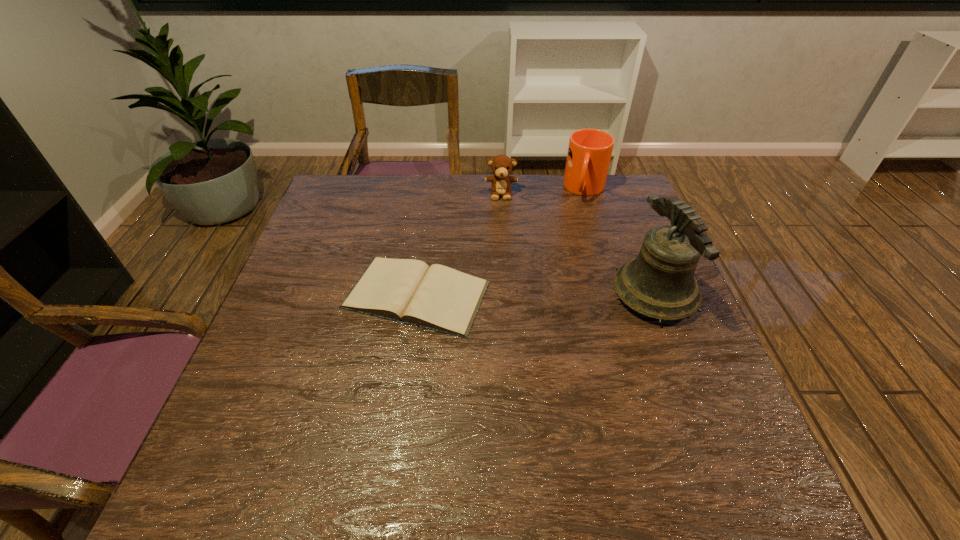
Locate an element on the screen. The height and width of the screenshot is (540, 960). empty space between the Bible and the second tallest object is located at coordinates (501, 242).

Locate an element on the screen. The height and width of the screenshot is (540, 960). free space that is in between the teddy bear and the mug is located at coordinates (543, 192).

Identify the location of blank region between the bell and the third tallest object. (578, 244).

Locate an element on the screen. The height and width of the screenshot is (540, 960). object that is the third closest one to the shortest object is located at coordinates (589, 153).

Identify which object is located as the third nearest to the shortest object. Please provide its 2D coordinates. Your answer should be formatted as a tuple, i.e. [(x, y)], where the tuple contains the x and y coordinates of a point satisfying the conditions above.

[(589, 153)]

Identify the location of free region that satisfies the following two spatial constraints: 1. on the front side of the mug; 2. on the left side of the tallest object. (617, 294).

The height and width of the screenshot is (540, 960). Find the location of `free space that satisfies the following two spatial constraints: 1. on the front side of the mug; 2. on the right side of the bell`. free space that satisfies the following two spatial constraints: 1. on the front side of the mug; 2. on the right side of the bell is located at coordinates (617, 294).

Identify the location of vacant region that satisfies the following two spatial constraints: 1. on the back side of the Bible; 2. on the right side of the teddy bear. (431, 194).

At what (x,y) coordinates should I click in order to perform the action: click on free space that satisfies the following two spatial constraints: 1. on the back side of the second shortest object; 2. on the right side of the shortest object. Please return your answer as a coordinate pair (x, y). This screenshot has width=960, height=540. Looking at the image, I should click on (431, 194).